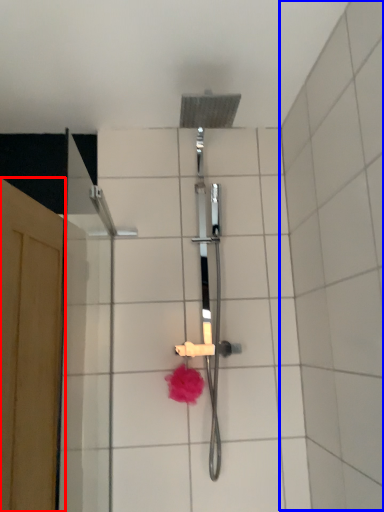
Question: Which object appears farthest to the camera in this image, screen door (highlighted by a red box) or ceramic tile (highlighted by a blue box)?

Choices:
 (A) screen door
 (B) ceramic tile

Answer: (A)